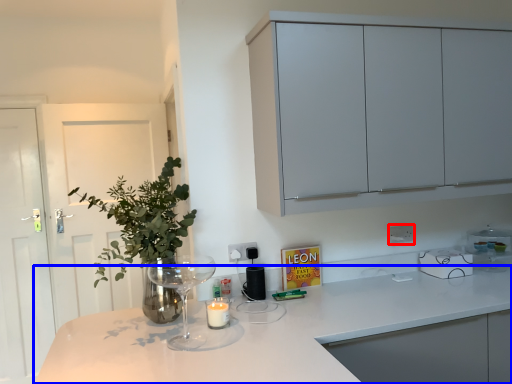
Question: Which object is further to the camera taking this photo, electric outlet (highlighted by a red box) or countertop (highlighted by a blue box)?

Choices:
 (A) electric outlet
 (B) countertop

Answer: (A)